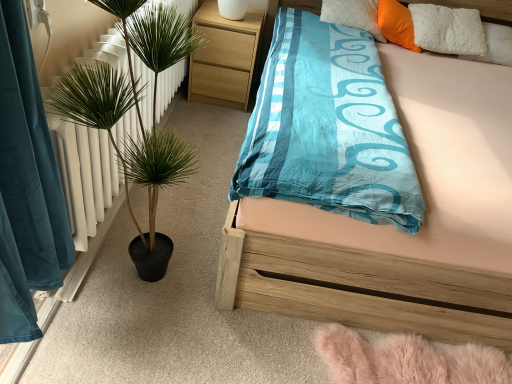
Question: Is wooden bed at center looking in the opposite direction of orange plush pillow at upper right?

Choices:
 (A) yes
 (B) no

Answer: (A)

Question: Is wooden bed at center smaller than orange plush pillow at upper right?

Choices:
 (A) yes
 (B) no

Answer: (B)

Question: From a real-world perspective, is wooden bed at center beneath orange plush pillow at upper right?

Choices:
 (A) yes
 (B) no

Answer: (A)

Question: Is the depth of wooden bed at center greater than that of orange plush pillow at upper right?

Choices:
 (A) yes
 (B) no

Answer: (B)

Question: Is orange plush pillow at upper right a part of wooden bed at center?

Choices:
 (A) no
 (B) yes

Answer: (B)

Question: Does wooden bed at center have a larger size compared to orange plush pillow at upper right?

Choices:
 (A) no
 (B) yes

Answer: (B)

Question: Considering the relative sizes of orange plush pillow at upper right and green leafy plant in pot at left in the image provided, is orange plush pillow at upper right thinner than green leafy plant in pot at left?

Choices:
 (A) yes
 (B) no

Answer: (A)

Question: Does orange plush pillow at upper right have a lesser height compared to green leafy plant in pot at left?

Choices:
 (A) no
 (B) yes

Answer: (B)

Question: Is orange plush pillow at upper right not within green leafy plant in pot at left?

Choices:
 (A) no
 (B) yes

Answer: (B)

Question: Can you confirm if orange plush pillow at upper right is wider than green leafy plant in pot at left?

Choices:
 (A) yes
 (B) no

Answer: (B)

Question: Does orange plush pillow at upper right contain green leafy plant in pot at left?

Choices:
 (A) yes
 (B) no

Answer: (B)

Question: Can you see orange plush pillow at upper right touching green leafy plant in pot at left?

Choices:
 (A) yes
 (B) no

Answer: (B)

Question: Is light wood/texture nightstand at upper center far from green leafy plant in pot at left?

Choices:
 (A) yes
 (B) no

Answer: (A)